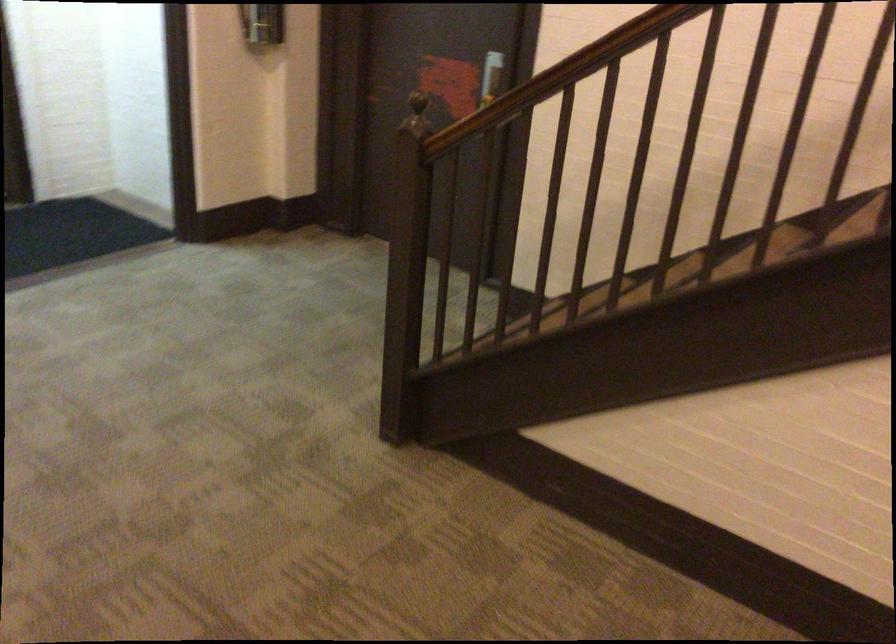
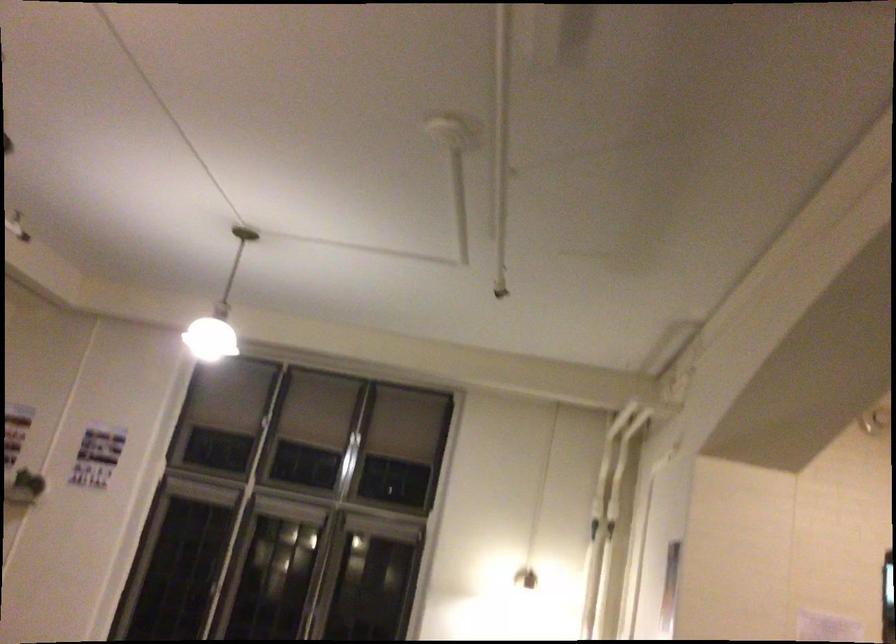
How did the camera likely rotate?

The rotation direction of the camera is left-up.